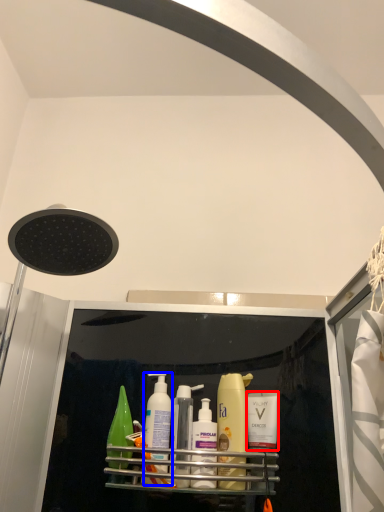
Question: Which object appears closest to the camera in this image, toiletry (highlighted by a red box) or cleaning product (highlighted by a blue box)?

Choices:
 (A) toiletry
 (B) cleaning product

Answer: (B)